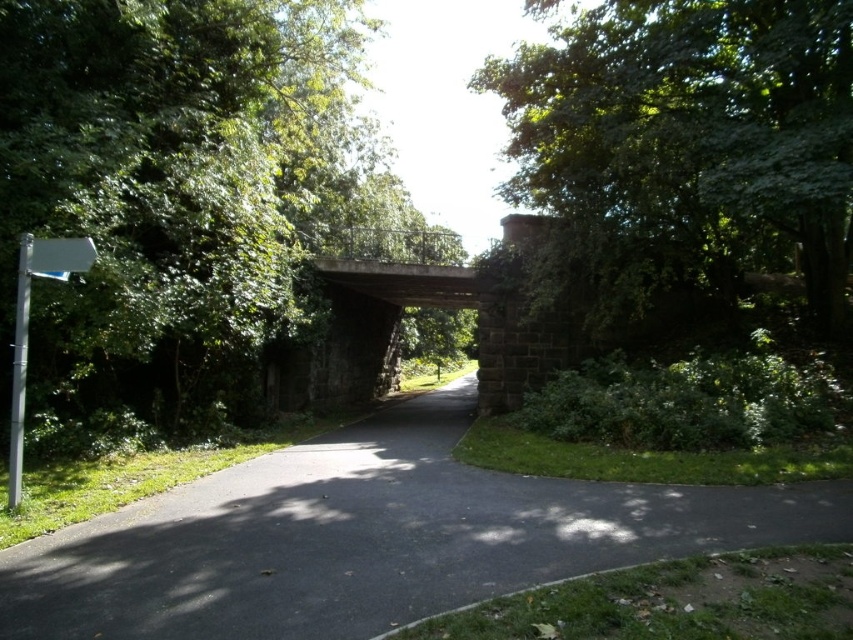
Between green leafy tree at upper left and asphalt at center, which one is positioned higher?

green leafy tree at upper left

The image size is (853, 640). What are the coordinates of `green leafy tree at upper left` in the screenshot? It's located at (172, 193).

The width and height of the screenshot is (853, 640). In order to click on green leafy tree at upper left in this screenshot , I will do `click(172, 193)`.

Consider the image. Does green leafy tree at upper left have a greater height compared to concrete bridge at center?

Yes.

Does point (300, 260) come in front of point (477, 301)?

Yes, it is.

Which is in front, point (199, 97) or point (376, 282)?

Point (199, 97) is in front.

Where is `green leafy tree at upper left`? This screenshot has height=640, width=853. green leafy tree at upper left is located at coordinates (172, 193).

Can you confirm if asphalt at center is thinner than concrete bridge at center?

In fact, asphalt at center might be wider than concrete bridge at center.

Between point (405, 480) and point (366, 289), which one is positioned in front?

Point (405, 480)

Image resolution: width=853 pixels, height=640 pixels. In order to click on asphalt at center in this screenshot , I will do `click(370, 538)`.